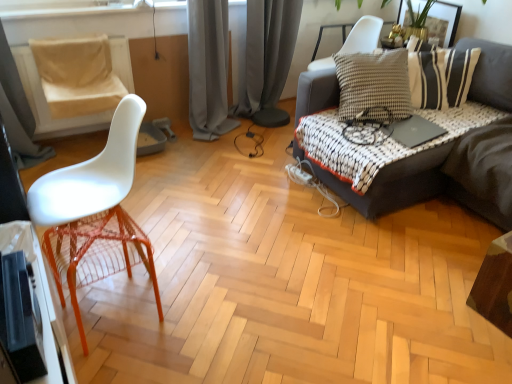
The width and height of the screenshot is (512, 384). What are the coordinates of `vacant area that is situated to the right of white plastic chair at left` in the screenshot? It's located at (200, 266).